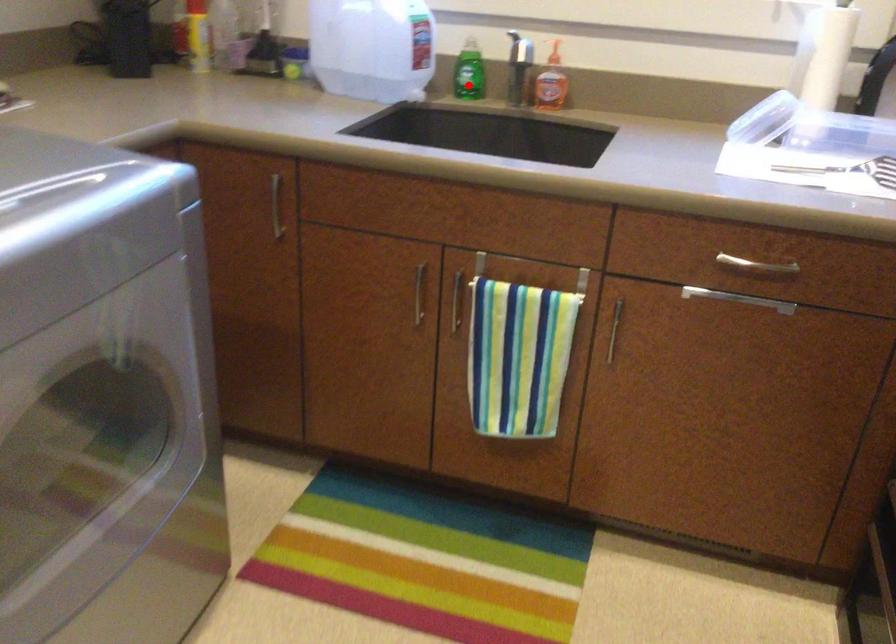
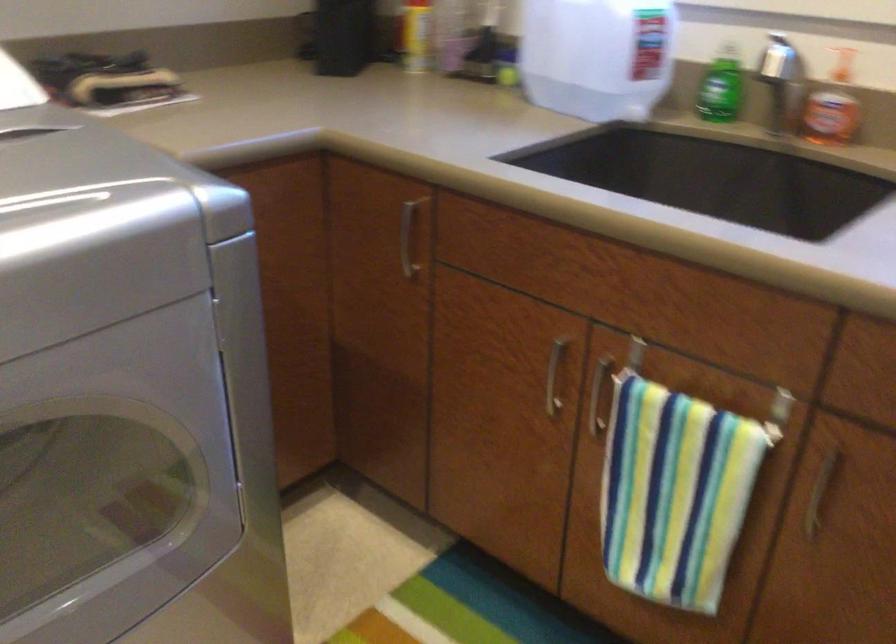
The point at the highlighted location is marked in the first image. Where is the corresponding point in the second image?

(718, 105)